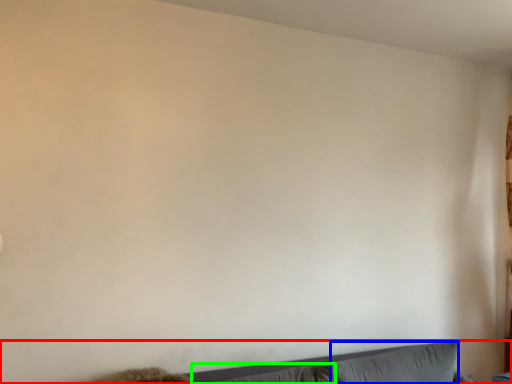
Question: Based on their relative distances, which object is nearer to couch (highlighted by a red box)? Choose from pillow (highlighted by a blue box) and pillow (highlighted by a green box).

Choices:
 (A) pillow
 (B) pillow

Answer: (B)